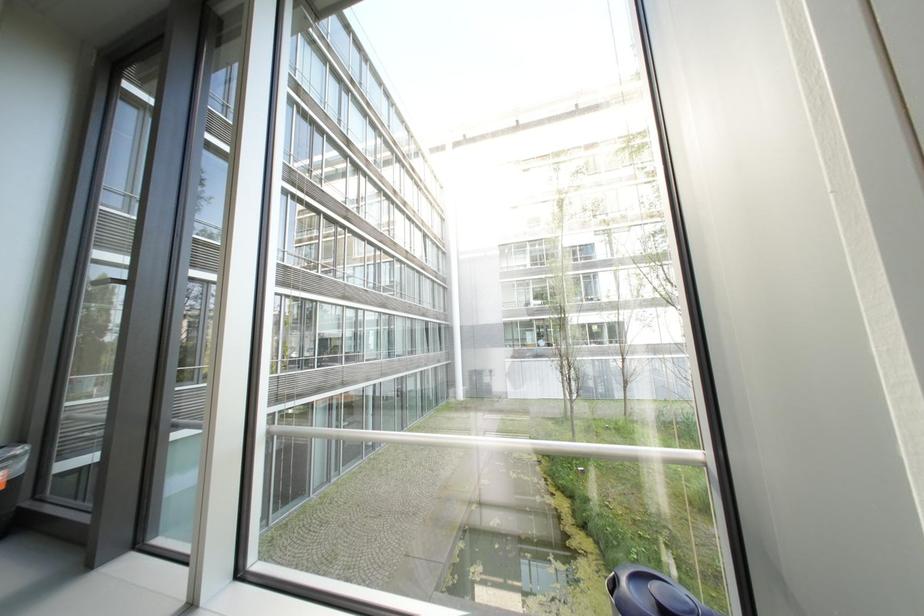
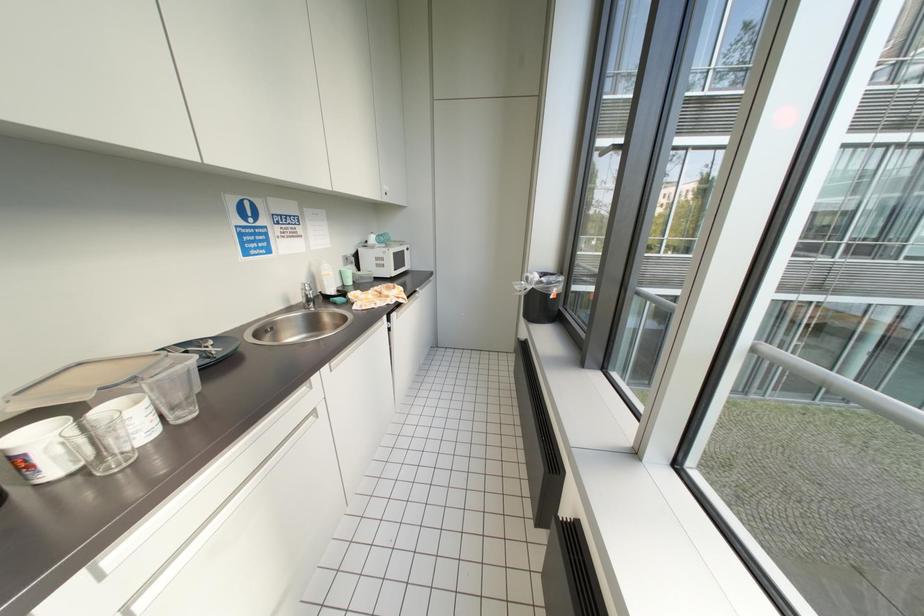
First-person continuous shooting, in which direction is the camera rotating?

The rotation direction of the camera is left-down.